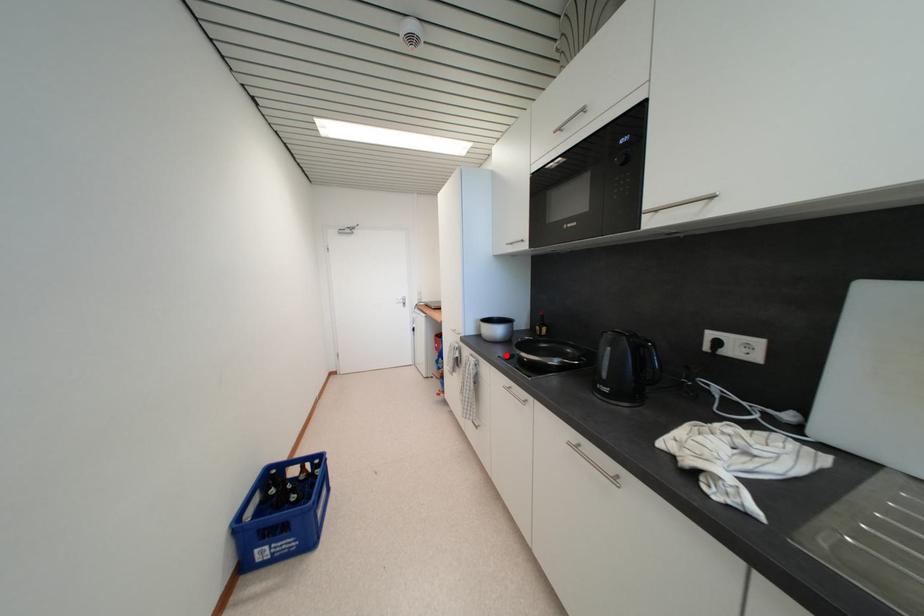
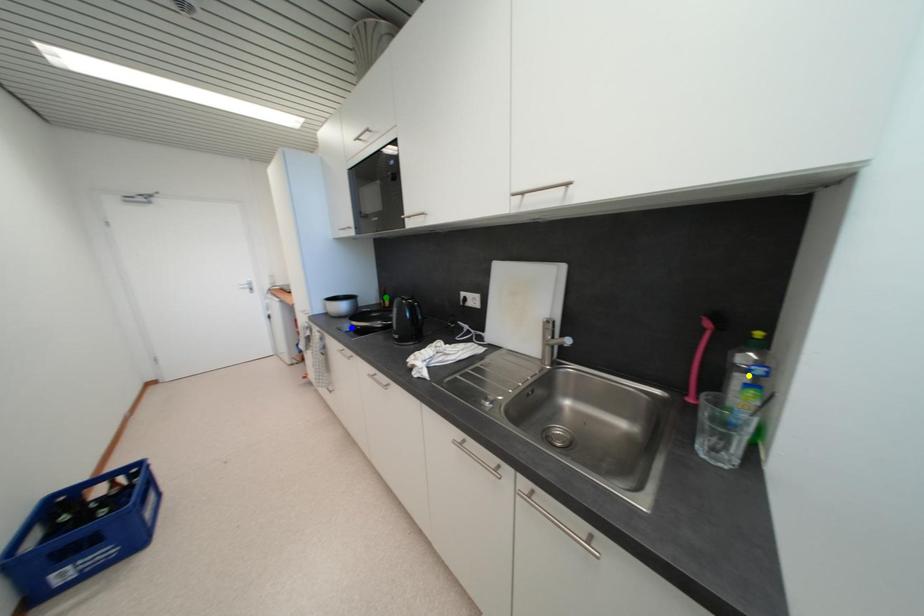
Question: I am providing you with two images of the same scene from different viewpoints. A red point is marked on the first image. You are given multiple points on the second image. Can you choose the point in image 2 that corresponds to the point in image 1?

Choices:
 (A) blue point
 (B) green point
 (C) yellow point

Answer: (A)